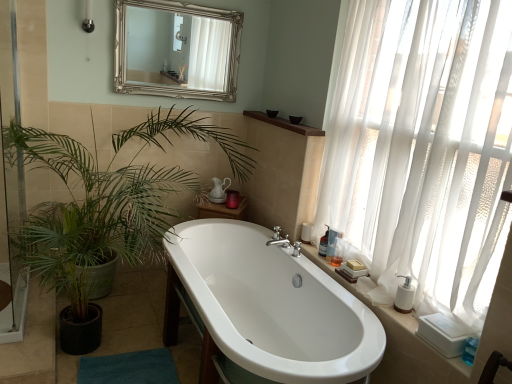
What are the coordinates of `free point above white ceramic counter top at right (from a real-world perspective)` in the screenshot? It's located at (372, 299).